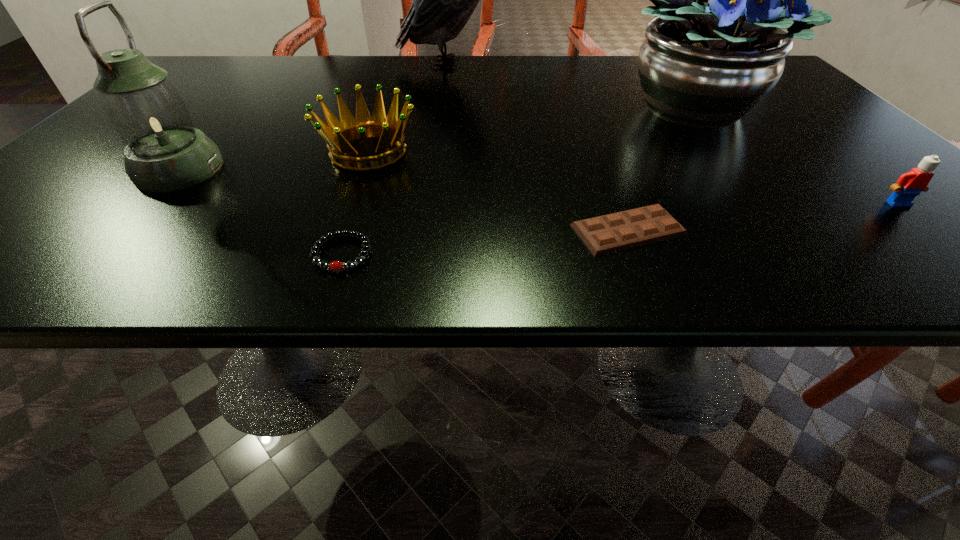
Find the location of `bouquet situated at the right edge`. bouquet situated at the right edge is located at coordinates (716, 49).

At what (x,y) coordinates should I click in order to perform the action: click on Lego present at the right edge. Please return your answer as a coordinate pair (x, y). The height and width of the screenshot is (540, 960). Looking at the image, I should click on (x=909, y=185).

You are a GUI agent. You are given a task and a screenshot of the screen. Output one action in this format:
    pyautogui.click(x=<x>, y=<y>)
    Task: Click on the object located at the far right corner
    The width and height of the screenshot is (960, 540).
    Given the screenshot: What is the action you would take?
    pyautogui.click(x=716, y=49)

Locate an element on the screen. The width and height of the screenshot is (960, 540). free spot at the far edge of the desktop is located at coordinates (300, 56).

This screenshot has height=540, width=960. I want to click on blank space at the near edge of the desktop, so click(x=817, y=268).

The width and height of the screenshot is (960, 540). I want to click on free spot at the right edge of the desktop, so click(x=822, y=157).

You are a GUI agent. You are given a task and a screenshot of the screen. Output one action in this format:
    pyautogui.click(x=<x>, y=<y>)
    Task: Click on the free region at the far left corner of the desktop
    This screenshot has height=540, width=960.
    Given the screenshot: What is the action you would take?
    pyautogui.click(x=188, y=82)

Find the location of a particular element. vacant space that's between the bouquet and the chocolate bar is located at coordinates (660, 168).

The image size is (960, 540). Find the location of `free space between the chocolate bar and the bracelet`. free space between the chocolate bar and the bracelet is located at coordinates (486, 242).

Locate an element on the screen. This screenshot has width=960, height=540. free space between the crown and the rightmost object is located at coordinates (634, 178).